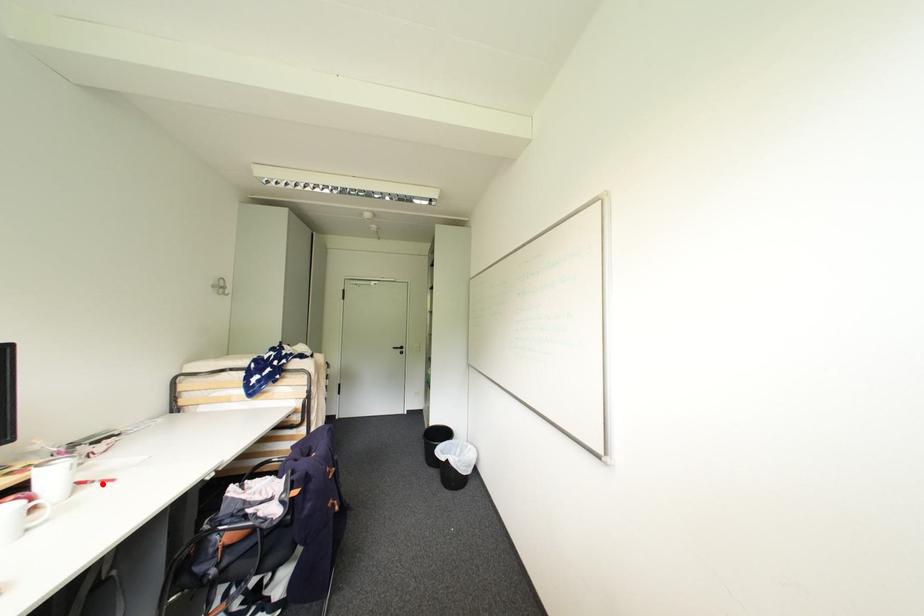
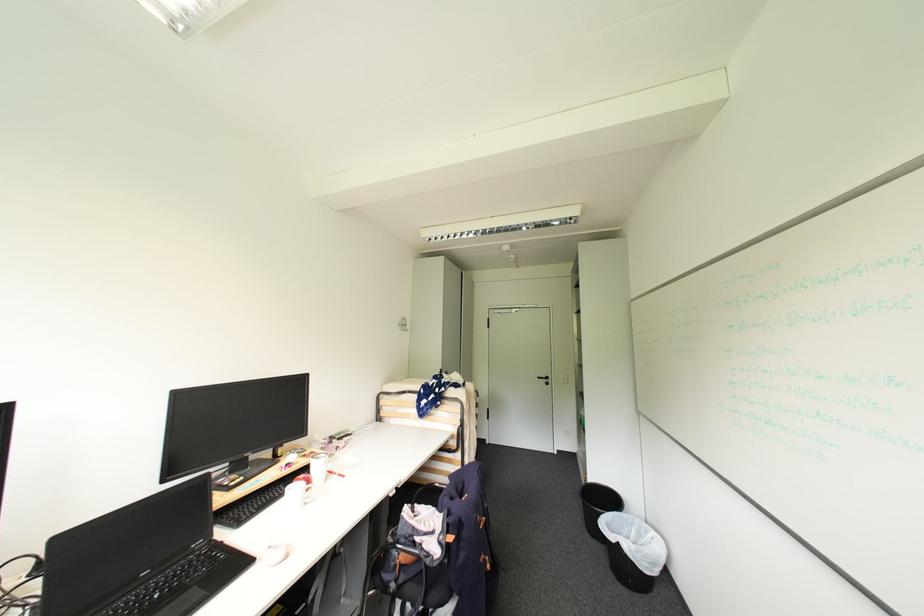
The point at the highlighted location is marked in the first image. Where is the corresponding point in the second image?

(343, 477)